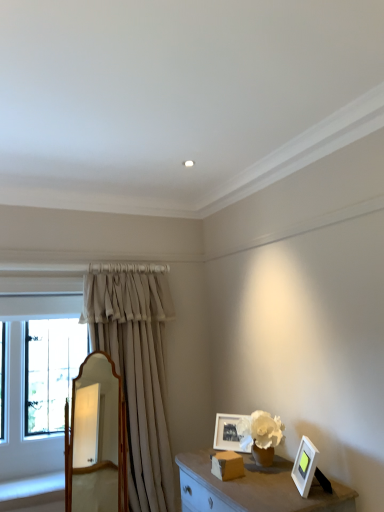
Question: Is wooden mirror at center wider or thinner than beige fabric curtain at left?

Choices:
 (A) wide
 (B) thin

Answer: (B)

Question: From their relative heights in the image, would you say wooden mirror at center is taller or shorter than beige fabric curtain at left?

Choices:
 (A) short
 (B) tall

Answer: (A)

Question: Which object is the closest to the matte white picture frame at center, marked as the 2th picture frame in a front-to-back arrangement?

Choices:
 (A) wooden mirror at center
 (B) beige fabric curtain at left
 (C) white matte picture frame at lower right, the 1th picture frame in the right-to-left sequence

Answer: (C)

Question: Which object is the closest to the white matte picture frame at lower right, the 1th picture frame from the front?

Choices:
 (A) wooden mirror at center
 (B) matte white picture frame at center, marked as the 2th picture frame in a front-to-back arrangement
 (C) beige fabric curtain at left

Answer: (B)